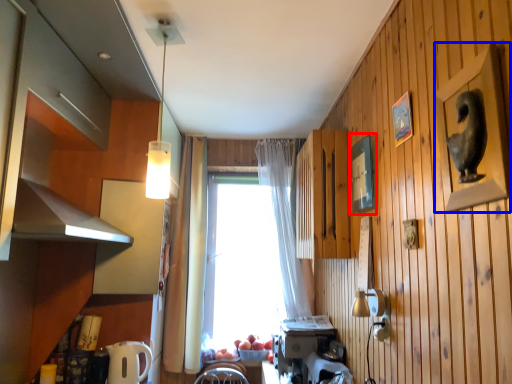
Question: Which object appears closest to the camera in this image, picture frame (highlighted by a red box) or picture frame (highlighted by a blue box)?

Choices:
 (A) picture frame
 (B) picture frame

Answer: (B)